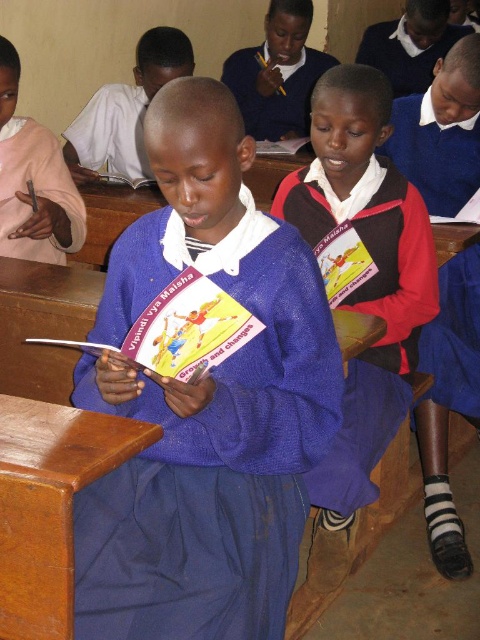
Which is more to the right, blue knitted sweater at center or brown wood table at lower left?

blue knitted sweater at center

Which is more to the left, blue knitted sweater at center or brown wood table at lower left?

From the viewer's perspective, brown wood table at lower left appears more on the left side.

Describe the element at coordinates (205, 403) in the screenshot. I see `blue knitted sweater at center` at that location.

The width and height of the screenshot is (480, 640). Identify the location of blue knitted sweater at center. (205, 403).

Who is higher up, matte blue sweater at center or blue uniform shirt at center?

blue uniform shirt at center

Does matte blue sweater at center have a greater height compared to blue uniform shirt at center?

Yes, matte blue sweater at center is taller than blue uniform shirt at center.

Between point (395, 358) and point (86, 140), which one is positioned behind?

Point (86, 140)

The height and width of the screenshot is (640, 480). What are the coordinates of `matte blue sweater at center` in the screenshot? It's located at (361, 272).

Is point (95, 328) more distant than point (320, 60)?

No.

Where is `blue knitted sweater at center`? This screenshot has width=480, height=640. blue knitted sweater at center is located at coordinates (205, 403).